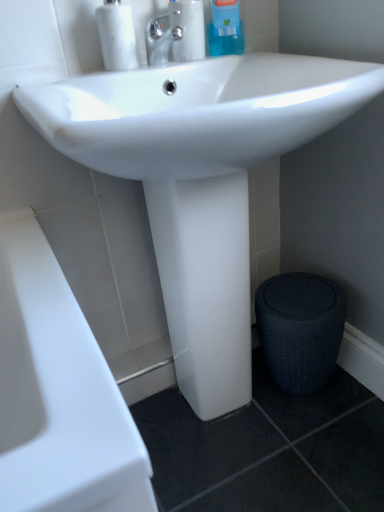
What do you see at coordinates (300, 329) in the screenshot? The height and width of the screenshot is (512, 384). I see `textured dark gray stool at lower right` at bounding box center [300, 329].

The width and height of the screenshot is (384, 512). Find the location of `white marble soap dispenser at upper left`. white marble soap dispenser at upper left is located at coordinates (117, 36).

This screenshot has height=512, width=384. In order to click on polished chrome faucet at upper center in this screenshot , I will do `click(160, 39)`.

What do you see at coordinates (225, 29) in the screenshot? I see `blue glossy bottle at upper center, which is counted as the first cleaning product, starting from the right` at bounding box center [225, 29].

The width and height of the screenshot is (384, 512). I want to click on textured dark gray stool at lower right, so click(300, 329).

Which object is further away from the camera, textured dark gray stool at lower right or blue glossy bottle at upper center, which is counted as the first cleaning product, starting from the right?

textured dark gray stool at lower right is behind.

Is point (292, 390) in front of point (222, 36)?

No, it is behind (222, 36).

Who is smaller, textured dark gray stool at lower right or blue glossy bottle at upper center, which is counted as the first cleaning product, starting from the right?

blue glossy bottle at upper center, which is counted as the first cleaning product, starting from the right, is smaller.

Is clear plastic bottle at upper center, which is the 1th cleaning product from left to right, far away from white marble soap dispenser at upper left?

They are positioned close to each other.

Is white marble soap dispenser at upper left a part of clear plastic bottle at upper center, which is the 1th cleaning product from left to right?

No, clear plastic bottle at upper center, which is the 1th cleaning product from left to right, does not contain white marble soap dispenser at upper left.

Is clear plastic bottle at upper center, which is the 1th cleaning product from left to right, positioned with its back to white marble soap dispenser at upper left?

No, clear plastic bottle at upper center, which is the 1th cleaning product from left to right, is not facing away from white marble soap dispenser at upper left.

From a real-world perspective, which is physically above, clear plastic bottle at upper center, which is counted as the 2th cleaning product, starting from the right, or white marble soap dispenser at upper left?

white marble soap dispenser at upper left is physically above.

Locate an element on the screen. porcelain below the blue glossy bottle at upper center, which is the 2th cleaning product from left to right (from the image's perspective) is located at coordinates (300, 329).

From a real-world perspective, who is located lower, blue glossy bottle at upper center, which is counted as the first cleaning product, starting from the right, or textured dark gray stool at lower right?

textured dark gray stool at lower right.

Based on their positions, is blue glossy bottle at upper center, which is counted as the first cleaning product, starting from the right, located to the left or right of textured dark gray stool at lower right?

From the image, it's evident that blue glossy bottle at upper center, which is counted as the first cleaning product, starting from the right, is to the left of textured dark gray stool at lower right.

Consider the image. Considering the sizes of objects blue glossy bottle at upper center, which is the 2th cleaning product from left to right, and white marble soap dispenser at upper left in the image provided, who is shorter, blue glossy bottle at upper center, which is the 2th cleaning product from left to right, or white marble soap dispenser at upper left?

With less height is white marble soap dispenser at upper left.

Is blue glossy bottle at upper center, which is the 2th cleaning product from left to right, closer to the viewer compared to white marble soap dispenser at upper left?

No, the depth of blue glossy bottle at upper center, which is the 2th cleaning product from left to right, is greater than that of white marble soap dispenser at upper left.

From the image's perspective, is blue glossy bottle at upper center, which is the 2th cleaning product from left to right, above white marble soap dispenser at upper left?

Correct, blue glossy bottle at upper center, which is the 2th cleaning product from left to right, appears higher than white marble soap dispenser at upper left in the image.

Can we say blue glossy bottle at upper center, which is the 2th cleaning product from left to right, lies outside white marble soap dispenser at upper left?

Indeed, blue glossy bottle at upper center, which is the 2th cleaning product from left to right, is completely outside white marble soap dispenser at upper left.

Could you measure the distance between textured dark gray stool at lower right and clear plastic bottle at upper center, which is the 1th cleaning product from left to right?

They are 27.20 inches apart.

From a real-world perspective, starting from the textured dark gray stool at lower right, which cleaning product is the 1st one vertically above it? Please provide its 2D coordinates.

[(187, 29)]

Looking at this image, is textured dark gray stool at lower right turned away from clear plastic bottle at upper center, which is the 1th cleaning product from left to right?

No, textured dark gray stool at lower right is not facing the opposite direction of clear plastic bottle at upper center, which is the 1th cleaning product from left to right.

Considering the relative positions of textured dark gray stool at lower right and clear plastic bottle at upper center, which is the 1th cleaning product from left to right, in the image provided, is textured dark gray stool at lower right behind clear plastic bottle at upper center, which is the 1th cleaning product from left to right,?

Yes, textured dark gray stool at lower right is further from the camera.

This screenshot has width=384, height=512. Find the location of `porcelain that appears below the white marble soap dispenser at upper left (from the image's perspective)`. porcelain that appears below the white marble soap dispenser at upper left (from the image's perspective) is located at coordinates [300, 329].

Is textured dark gray stool at lower right at the back of white marble soap dispenser at upper left?

white marble soap dispenser at upper left is not turned away from textured dark gray stool at lower right.

Considering the relative sizes of white marble soap dispenser at upper left and textured dark gray stool at lower right in the image provided, is white marble soap dispenser at upper left bigger than textured dark gray stool at lower right?

Actually, white marble soap dispenser at upper left might be smaller than textured dark gray stool at lower right.

Is textured dark gray stool at lower right taller or shorter than white marble soap dispenser at upper left?

Clearly, textured dark gray stool at lower right is taller compared to white marble soap dispenser at upper left.

How much distance is there between textured dark gray stool at lower right and white marble soap dispenser at upper left?

textured dark gray stool at lower right is 28.70 inches from white marble soap dispenser at upper left.

From the image's perspective, which one is positioned lower, textured dark gray stool at lower right or white marble soap dispenser at upper left?

textured dark gray stool at lower right appears lower in the image.

Where is `porcelain below the blue glossy bottle at upper center, which is counted as the first cleaning product, starting from the right (from a real-world perspective)`? This screenshot has width=384, height=512. porcelain below the blue glossy bottle at upper center, which is counted as the first cleaning product, starting from the right (from a real-world perspective) is located at coordinates (300, 329).

In the image, there is a clear plastic bottle at upper center, which is counted as the 2th cleaning product, starting from the right. What are the coordinates of `soap dispenser below it (from the image's perspective)` in the screenshot? It's located at (117, 36).

Estimate the real-world distances between objects in this image. Which object is closer to blue glossy bottle at upper center, which is counted as the first cleaning product, starting from the right, polished chrome faucet at upper center or white marble soap dispenser at upper left?

The object closer to blue glossy bottle at upper center, which is counted as the first cleaning product, starting from the right, is polished chrome faucet at upper center.

Considering their positions, is white marble soap dispenser at upper left positioned closer to clear plastic bottle at upper center, which is the 1th cleaning product from left to right, than textured dark gray stool at lower right?

The object closer to clear plastic bottle at upper center, which is the 1th cleaning product from left to right, is white marble soap dispenser at upper left.

Based on their spatial positions, is clear plastic bottle at upper center, which is the 1th cleaning product from left to right, or textured dark gray stool at lower right further from white marble soap dispenser at upper left?

Based on the image, textured dark gray stool at lower right appears to be further to white marble soap dispenser at upper left.

When comparing their distances from textured dark gray stool at lower right, does white marble soap dispenser at upper left or blue glossy bottle at upper center, which is the 2th cleaning product from left to right, seem further?

white marble soap dispenser at upper left is positioned further to the anchor textured dark gray stool at lower right.

Which object lies nearer to the anchor point blue glossy bottle at upper center, which is counted as the first cleaning product, starting from the right, white marble soap dispenser at upper left or polished chrome faucet at upper center?

The object closer to blue glossy bottle at upper center, which is counted as the first cleaning product, starting from the right, is polished chrome faucet at upper center.

From the image, which object appears to be farther from clear plastic bottle at upper center, which is the 1th cleaning product from left to right, blue glossy bottle at upper center, which is counted as the first cleaning product, starting from the right, or textured dark gray stool at lower right?

textured dark gray stool at lower right is further to clear plastic bottle at upper center, which is the 1th cleaning product from left to right.

Based on the photo, from the image, which object appears to be farther from textured dark gray stool at lower right, white marble soap dispenser at upper left or polished chrome faucet at upper center?

The object further to textured dark gray stool at lower right is white marble soap dispenser at upper left.

Estimate the real-world distances between objects in this image. Which object is further from blue glossy bottle at upper center, which is the 2th cleaning product from left to right, clear plastic bottle at upper center, which is counted as the 2th cleaning product, starting from the right, or white marble soap dispenser at upper left?

white marble soap dispenser at upper left is positioned further to the anchor blue glossy bottle at upper center, which is the 2th cleaning product from left to right.

Locate an element on the screen. tap between white marble soap dispenser at upper left and blue glossy bottle at upper center, which is counted as the first cleaning product, starting from the right, in the horizontal direction is located at coordinates (160, 39).

The width and height of the screenshot is (384, 512). What are the coordinates of `soap dispenser between blue glossy bottle at upper center, which is counted as the first cleaning product, starting from the right, and textured dark gray stool at lower right, in the vertical direction` in the screenshot? It's located at (117, 36).

Identify the location of tap that lies between white marble soap dispenser at upper left and textured dark gray stool at lower right from top to bottom. (160, 39).

Identify the location of cleaning product between blue glossy bottle at upper center, which is the 2th cleaning product from left to right, and polished chrome faucet at upper center in the up-down direction. The height and width of the screenshot is (512, 384). (187, 29).